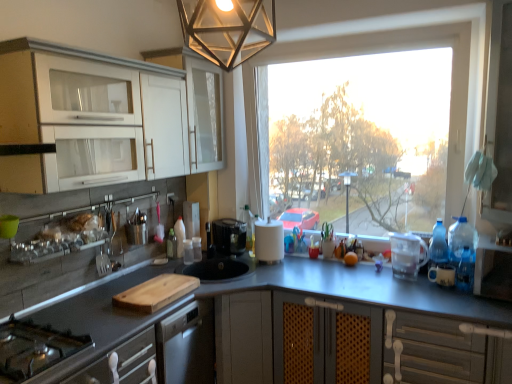
Locate an element on the screen. Image resolution: width=512 pixels, height=384 pixels. free space between orange matte at counter and white matte paper towel at center is located at coordinates (308, 266).